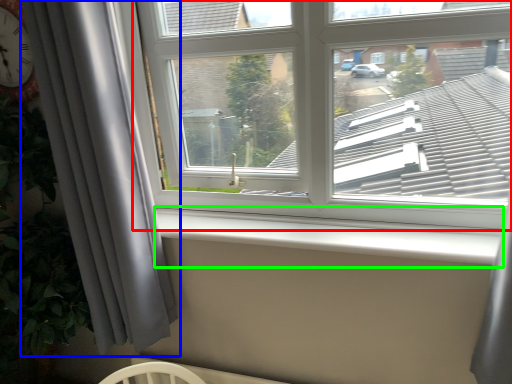
Question: Which object is positioned closest to window (highlighted by a red box)? Select from curtain (highlighted by a blue box) and window sill (highlighted by a green box).

Choices:
 (A) curtain
 (B) window sill

Answer: (B)